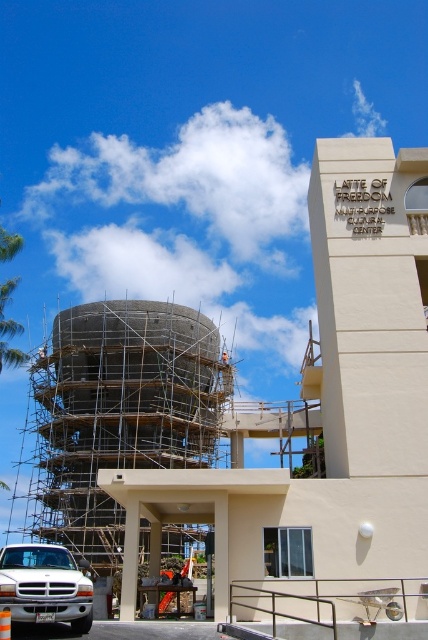
You are a construction worker standing at the point marked as point [115,416]. You need to move to the beige building with the balcony on the right. Is the beige building with the balcony on the right to your left or right side?

The beige building with the balcony on the right is to your right side because the point [115,416] is on the scaffolding at center, so the beige building is positioned to the right of the scaffolding.

You are a delivery driver who needs to park your white matte truck at lower left as close as possible to the orange safety vest at center on the construction site. Given that the parking area has a maximum allowed distance of 50 meters between vehicles and designated spots, can you park your truck at the current position?

The white matte truck at lower left and orange safety vest at center are 47.24 meters apart from each other. Since the distance is within the 50 meters limit, you can park the white matte truck at lower left at its current position.

You are a worker at the construction site. You need to move the orange safety vest at center to the right side of the scaffolding at center. Is this possible given their sizes?

The scaffolding at center might be wider than orange safety vest at center, so it is possible to move the orange safety vest at center to the right side of the scaffolding at center as the scaffolding is wider and can accommodate the vest on its side.